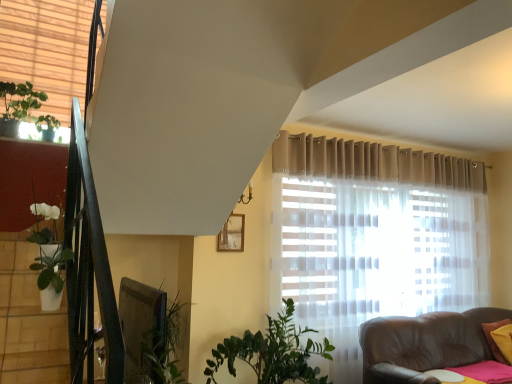
Question: Can we say green matte plant at upper left lies outside beige fabric blinds at upper left?

Choices:
 (A) yes
 (B) no

Answer: (B)

Question: From the image's perspective, would you say green matte plant at upper left is positioned over beige fabric blinds at upper left?

Choices:
 (A) yes
 (B) no

Answer: (B)

Question: Is green matte plant at upper left at the right side of beige fabric blinds at upper left?

Choices:
 (A) no
 (B) yes

Answer: (A)

Question: Is green matte plant at upper left placed right next to beige fabric blinds at upper left?

Choices:
 (A) no
 (B) yes

Answer: (A)

Question: Can you confirm if green matte plant at upper left is smaller than beige fabric blinds at upper left?

Choices:
 (A) yes
 (B) no

Answer: (A)

Question: Can you confirm if green matte plant at upper left is bigger than beige fabric blinds at upper left?

Choices:
 (A) no
 (B) yes

Answer: (A)

Question: From a real-world perspective, is white glossy pot at left positioned over beige fabric blinds at upper left based on gravity?

Choices:
 (A) no
 (B) yes

Answer: (A)

Question: From the image's perspective, is white glossy pot at left on top of beige fabric blinds at upper left?

Choices:
 (A) no
 (B) yes

Answer: (A)

Question: Does white glossy pot at left contain beige fabric blinds at upper left?

Choices:
 (A) no
 (B) yes

Answer: (A)

Question: Does white glossy pot at left appear on the left side of beige fabric blinds at upper left?

Choices:
 (A) no
 (B) yes

Answer: (A)

Question: Is white glossy pot at left touching beige fabric blinds at upper left?

Choices:
 (A) no
 (B) yes

Answer: (A)

Question: Is white glossy pot at left far away from beige fabric blinds at upper left?

Choices:
 (A) yes
 (B) no

Answer: (A)

Question: Does yellow fabric pillow at lower right have a lesser width compared to wooden frame at upper center?

Choices:
 (A) yes
 (B) no

Answer: (B)